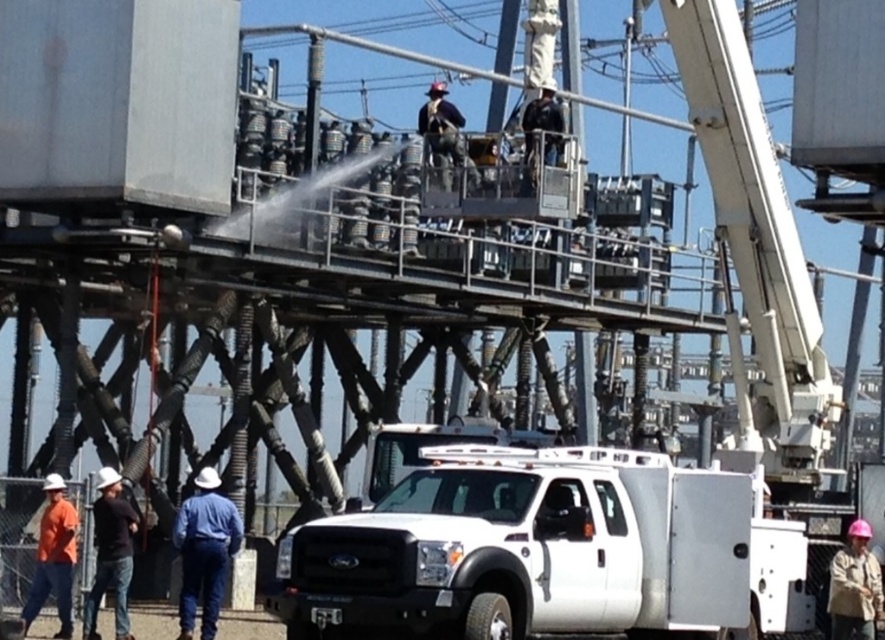
You are an inspector at the power plant. You need to compare the sizes of the white metallic utility truck at center and the pink hard hat at lower right. Which object is bigger?

The white metallic utility truck at center is larger in size than the pink hard hat at lower right, so the white metallic utility truck at center is bigger.